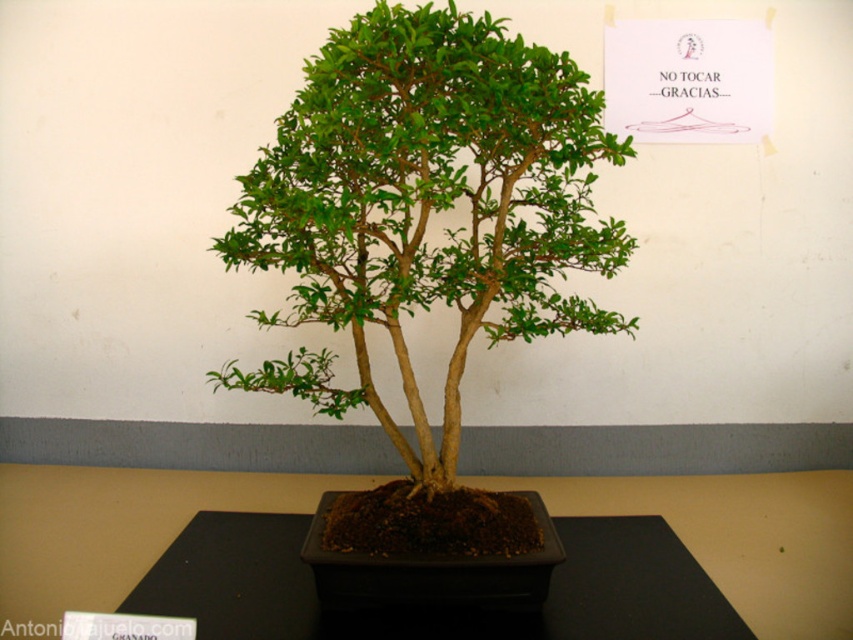
You are a visitor at an art exhibit and see the green matte bonsai tree at center and the black matte table at center. The exhibit has a strict rule that visitors must stay at least 18 inches away from all displayed items. Are you compliant with this rule if you stand exactly between the two objects?

The distance between the green matte bonsai tree at center and the black matte table at center is 16.73 inches. Since you are standing exactly between them, your distance from each object would be half of 16.73 inches, which is approximately 8.36 inches. This is less than the required 18 inches, so you are not compliant with the exhibit rule.

In the scene shown: You are a visitor at an art gallery and see the green matte bonsai tree at center displayed on a black platform. The sign nearby says not to touch. If you want to take a photo without moving closer than 30 inches, will you be able to capture the entire bonsai tree in your shot?

The distance between you and the green matte bonsai tree at center is 31.02 inches, which is more than 30 inches. Therefore, you can take a photo from your current position without moving closer and still capture the entire bonsai tree in the shot.

You are a visitor at an art gallery and see the green matte bonsai tree at center and the black matte table at center. Which object is closer to you?

The green matte bonsai tree at center is closer to you since it is in front of the black matte table at center.